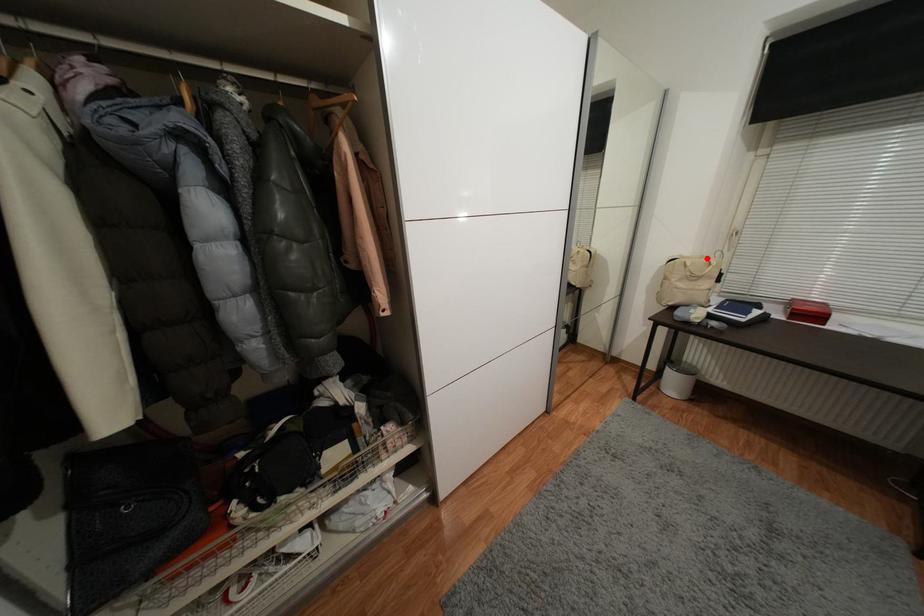
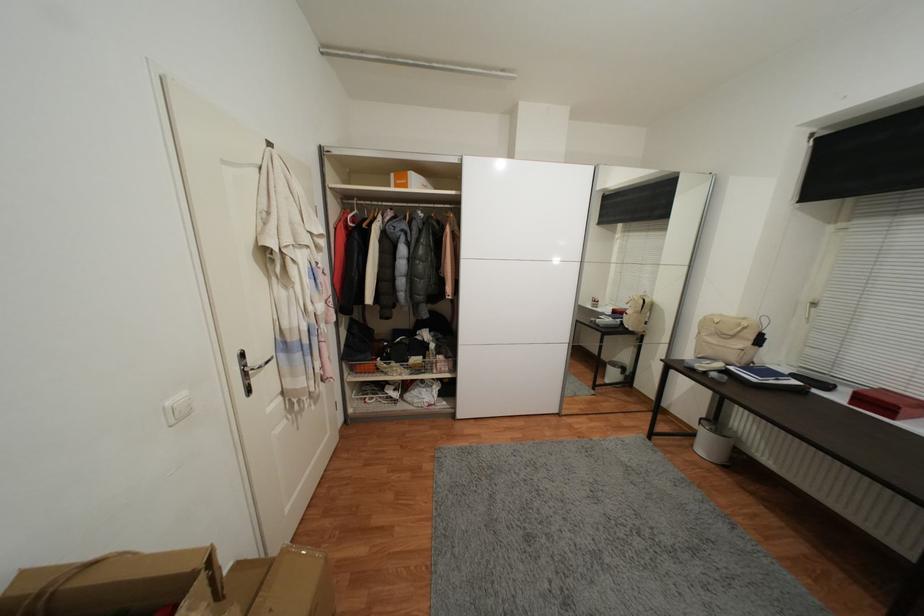
The point at the highlighted location is marked in the first image. Where is the corresponding point in the second image?

(748, 321)